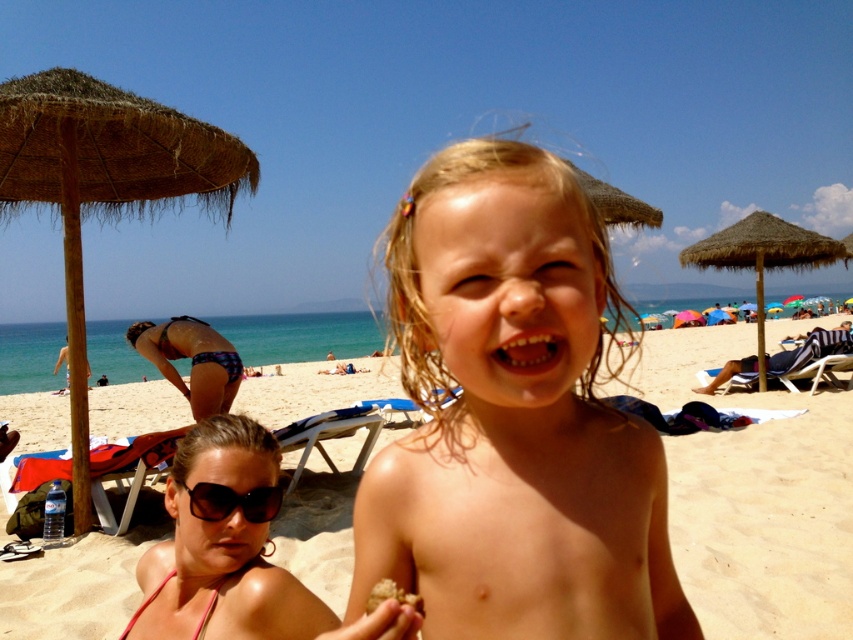
You are a parent at the beach and notice your child is playing near the beige sand at center and the brown crumbly food at center. Which material is more likely to get into their eyes and cause discomfort?

The brown crumbly food at center is smaller in size compared to the beige sand at center, so it is more likely to get into the child eyes and cause discomfort.

You are a photographer trying to capture the perfect shot of the beige sand at center and the plaid bikini bottom at lower left. Since you want to highlight the texture differences between the two, which object should you focus on to emphasize its larger size?

The beige sand at center has a larger size compared to the plaid bikini bottom at lower left, so focusing on the beige sand at center will emphasize its larger texture.

You are a photographer setting up for a beach photo shoot. You need to place a small prop between the beige sand at center and the plaid bikini bottom at lower left. Based on their positions, which object should the prop be closer to?

The prop should be placed closer to the plaid bikini bottom at lower left because the beige sand at center is closer to the viewer, meaning the plaid bikini bottom is further back, so placing the prop closer to it would maintain spatial harmony.